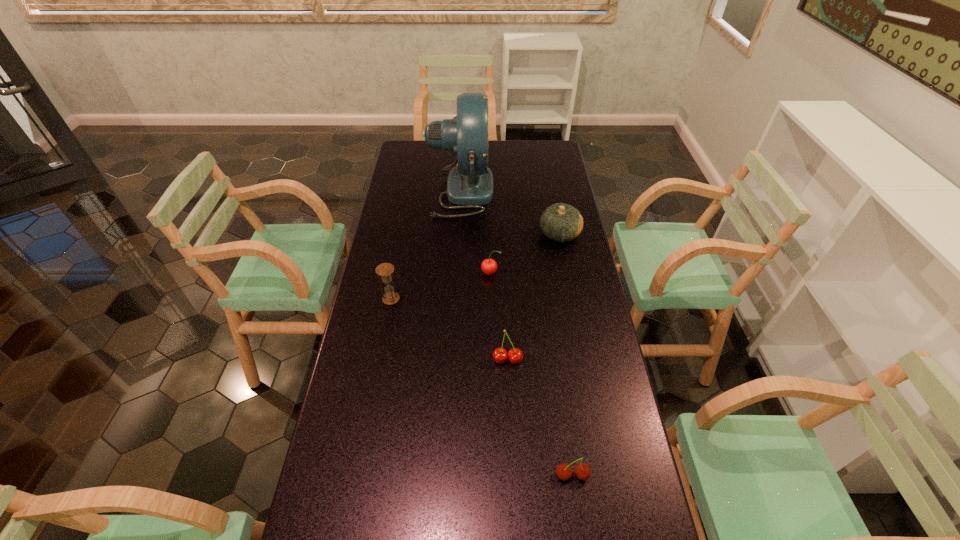
Identify the location of vacant area situated 0.160m on the right of the third nearest object. (447, 299).

You are a GUI agent. You are given a task and a screenshot of the screen. Output one action in this format:
    pyautogui.click(x=<x>, y=<y>)
    Task: Click on the vacant space situated on the left of the second farthest object
    The image size is (960, 540).
    Given the screenshot: What is the action you would take?
    pyautogui.click(x=464, y=234)

Locate an element on the screen. This screenshot has height=540, width=960. vacant area located on the right of the farthest cherry is located at coordinates (520, 273).

Where is `vacant space situated 0.230m with the stems of the second farthest cherry pointing upwards`? This screenshot has height=540, width=960. vacant space situated 0.230m with the stems of the second farthest cherry pointing upwards is located at coordinates (512, 443).

The image size is (960, 540). Find the location of `vacant space located on the surface of the rightmost cherry`. vacant space located on the surface of the rightmost cherry is located at coordinates (579, 525).

This screenshot has height=540, width=960. I want to click on object at the far edge, so click(470, 183).

Where is `object that is at the left edge`? This screenshot has height=540, width=960. object that is at the left edge is located at coordinates [x=385, y=270].

The image size is (960, 540). What are the coordinates of `gourd located at the right edge` in the screenshot? It's located at pos(561,222).

The image size is (960, 540). In order to click on cherry at the right edge in this screenshot , I will do `click(564, 472)`.

The width and height of the screenshot is (960, 540). I want to click on vacant space at the far edge of the desktop, so click(x=441, y=160).